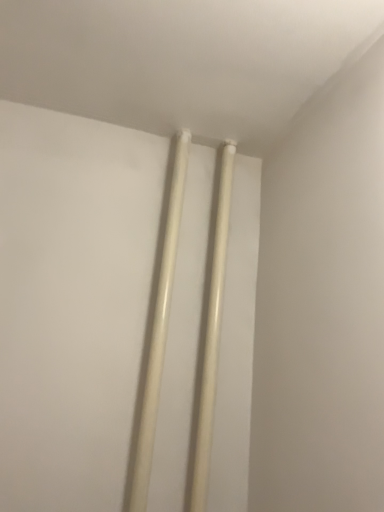
Describe the element at coordinates (159, 331) in the screenshot. I see `white glossy chopsticks at center` at that location.

Where is `white glossy chopsticks at center`? Image resolution: width=384 pixels, height=512 pixels. white glossy chopsticks at center is located at coordinates (159, 331).

Locate an element on the screen. white glossy curtain rod at upper center is located at coordinates (212, 336).

This screenshot has height=512, width=384. Describe the element at coordinates (212, 336) in the screenshot. I see `white glossy curtain rod at upper center` at that location.

This screenshot has height=512, width=384. I want to click on white glossy chopsticks at center, so click(159, 331).

Visually, is white glossy curtain rod at upper center positioned to the left or to the right of white glossy chopsticks at center?

white glossy curtain rod at upper center is to the right of white glossy chopsticks at center.

Consider the image. Considering the positions of objects white glossy curtain rod at upper center and white glossy chopsticks at center in the image provided, who is in front, white glossy curtain rod at upper center or white glossy chopsticks at center?

white glossy chopsticks at center.

Which is in front, point (219, 249) or point (164, 347)?

Point (164, 347)

From the image's perspective, relative to white glossy chopsticks at center, is white glossy curtain rod at upper center above or below?

Clearly, from the image's perspective, white glossy curtain rod at upper center is below white glossy chopsticks at center.

From a real-world perspective, is white glossy curtain rod at upper center positioned under white glossy chopsticks at center based on gravity?

Actually, white glossy curtain rod at upper center is physically above white glossy chopsticks at center in the real world.

Is white glossy curtain rod at upper center wider than white glossy chopsticks at center?

In fact, white glossy curtain rod at upper center might be narrower than white glossy chopsticks at center.

Is white glossy curtain rod at upper center taller or shorter than white glossy chopsticks at center?

white glossy curtain rod at upper center is taller than white glossy chopsticks at center.

Who is bigger, white glossy curtain rod at upper center or white glossy chopsticks at center?

With larger size is white glossy chopsticks at center.

Do you think white glossy curtain rod at upper center is within white glossy chopsticks at center, or outside of it?

white glossy curtain rod at upper center exists outside the volume of white glossy chopsticks at center.

Can you see white glossy curtain rod at upper center touching white glossy chopsticks at center?

white glossy curtain rod at upper center and white glossy chopsticks at center are not in contact.

Is white glossy curtain rod at upper center oriented towards white glossy chopsticks at center?

No, white glossy curtain rod at upper center is not aimed at white glossy chopsticks at center.

How different are the orientations of white glossy curtain rod at upper center and white glossy chopsticks at center in degrees?

0.00137 degrees.

How much distance is there between white glossy curtain rod at upper center and white glossy chopsticks at center?

The distance of white glossy curtain rod at upper center from white glossy chopsticks at center is 5.40 inches.

Identify the location of beam that is behind the white glossy chopsticks at center. (212, 336).

Which object is positioned more to the right, white glossy chopsticks at center or white glossy curtain rod at upper center?

From the viewer's perspective, white glossy curtain rod at upper center appears more on the right side.

In the image, is white glossy chopsticks at center positioned in front of or behind white glossy curtain rod at upper center?

Clearly, white glossy chopsticks at center is in front of white glossy curtain rod at upper center.

Which is behind, point (150, 460) or point (217, 232)?

The point (217, 232) is behind.

Consider the image. From the image's perspective, does white glossy chopsticks at center appear higher than white glossy curtain rod at upper center?

Indeed, from the image's perspective, white glossy chopsticks at center is shown above white glossy curtain rod at upper center.

From a real-world perspective, who is located higher, white glossy chopsticks at center or white glossy curtain rod at upper center?

In real-world perspective, white glossy curtain rod at upper center is above.

Which of these two, white glossy chopsticks at center or white glossy curtain rod at upper center, is thinner?

white glossy curtain rod at upper center is thinner.

Does white glossy chopsticks at center have a greater height compared to white glossy curtain rod at upper center?

No, white glossy chopsticks at center is not taller than white glossy curtain rod at upper center.

Which of these two, white glossy chopsticks at center or white glossy curtain rod at upper center, is bigger?

Bigger between the two is white glossy chopsticks at center.

Is white glossy chopsticks at center outside of white glossy curtain rod at upper center?

Yes.

Are white glossy chopsticks at center and white glossy curtain rod at upper center located far from each other?

No.

Is white glossy chopsticks at center positioned with its back to white glossy curtain rod at upper center?

That's not correct — white glossy chopsticks at center is not looking away from white glossy curtain rod at upper center.

How many degrees apart are the facing directions of white glossy chopsticks at center and white glossy curtain rod at upper center?

There is a 0.00137-degree angle between the facing directions of white glossy chopsticks at center and white glossy curtain rod at upper center.

In order to click on beam below the white glossy chopsticks at center (from the image's perspective) in this screenshot , I will do `click(212, 336)`.

This screenshot has height=512, width=384. Find the location of `beam above the white glossy chopsticks at center (from a real-world perspective)`. beam above the white glossy chopsticks at center (from a real-world perspective) is located at coordinates (212, 336).

Where is `chopsticks below the white glossy curtain rod at upper center (from a real-world perspective)`? The height and width of the screenshot is (512, 384). chopsticks below the white glossy curtain rod at upper center (from a real-world perspective) is located at coordinates (159, 331).